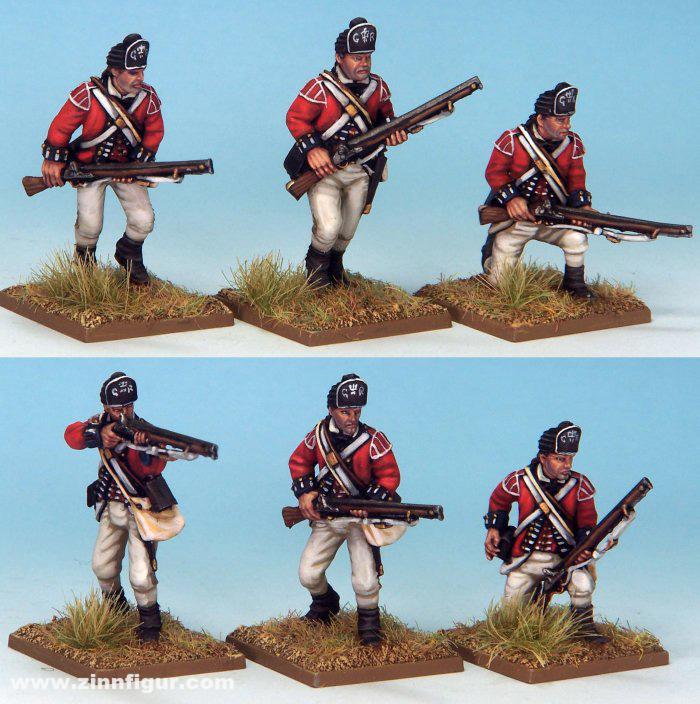
You are a GUI agent. You are given a task and a screenshot of the screen. Output one action in this format:
    pyautogui.click(x=<x>, y=<y>)
    Task: Click on the canteen
    This screenshot has width=700, height=704.
    Given the screenshot: What is the action you would take?
    pyautogui.click(x=160, y=491)